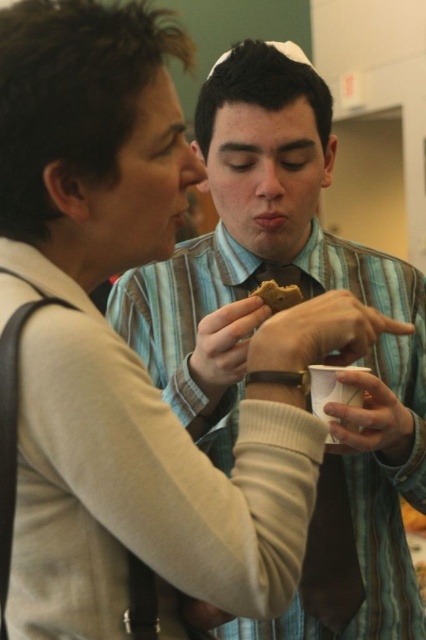
Is matte brown tie at center closer to the viewer compared to brown crumbly cookie at center?

That is True.

Is matte brown tie at center wider than brown crumbly cookie at center?

Yes.

Between point (374, 508) and point (287, 289), which one is positioned behind?

The point (374, 508) is behind.

This screenshot has width=426, height=640. Identify the location of matte brown tie at center. (264, 317).